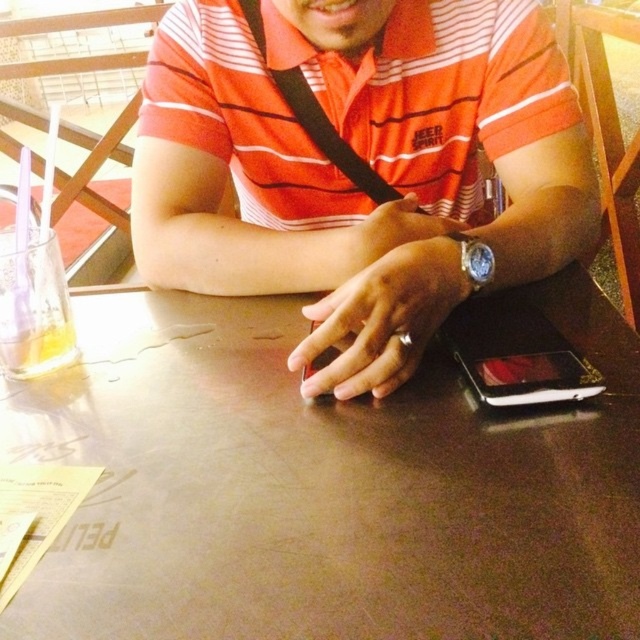
You are a customer in a cafe and want to place your order. The cashier is standing at the counter, which is located at point 0.761, 0.509. You are currently at the entrance of the cafe, which is on the opposite side of the room. To reach the counter, should you walk towards the metallic brown table at center?

The metallic brown table at center is located at point (324, 486), which is where the cashier is standing. Therefore, you should walk towards the metallic brown table at center to reach the counter.

You are trying to place a small coaster under the glass on the metallic brown table at center. The coaster is the size of the matte black phone at center. Will the coaster fit on the table without overlapping the edges?

The metallic brown table at center occupies less space than the matte black phone at center, so the coaster, which is the size of the matte black phone at center, will not fit on the table without overlapping the edges.

What is the spatial relationship between the metallic brown table at center and the point at coordinates (324, 486)?

The point at coordinates (324, 486) represents the metallic brown table at center.